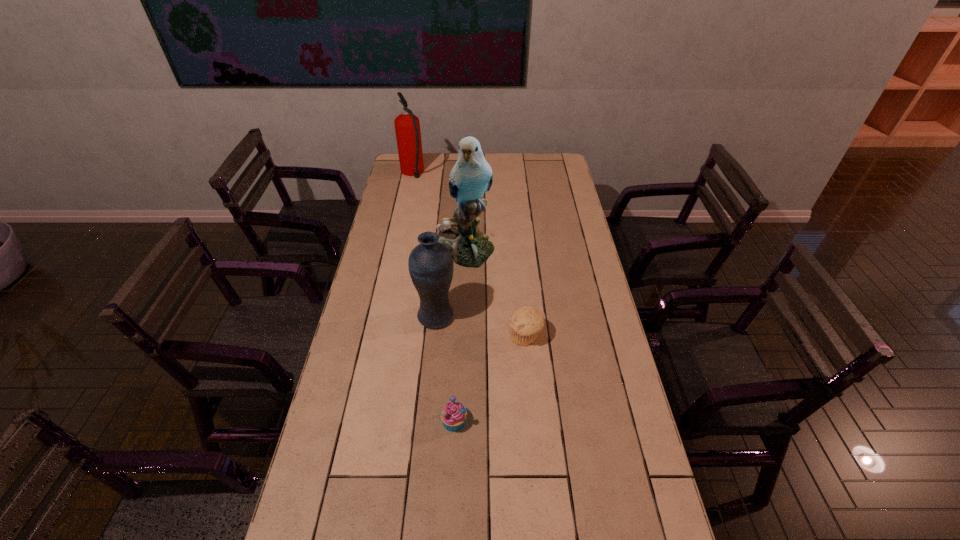
The width and height of the screenshot is (960, 540). Identify the location of vacant area situated 0.100m on the handle side of the fire extinguisher. (417, 153).

Where is `vacant area situated on the handle side of the fire extinguisher`? The height and width of the screenshot is (540, 960). vacant area situated on the handle side of the fire extinguisher is located at coordinates (417, 154).

The width and height of the screenshot is (960, 540). What are the coordinates of `free space located on the left of the vase` in the screenshot? It's located at (399, 316).

You are a GUI agent. You are given a task and a screenshot of the screen. Output one action in this format:
    pyautogui.click(x=<x>, y=<y>)
    Task: Click on the vacant space situated 0.240m on the left of the rightmost object
    
    Given the screenshot: What is the action you would take?
    pyautogui.click(x=438, y=336)

Identify the location of vacant space positioned 0.310m on the left of the left muffin. (333, 421).

In order to click on object that is at the far edge in this screenshot , I will do `click(407, 126)`.

At what (x,y) coordinates should I click in order to perform the action: click on object that is positioned at the left edge. Please return your answer as a coordinate pair (x, y). Looking at the image, I should click on (407, 126).

Identify the location of object positioned at the far left corner. Image resolution: width=960 pixels, height=540 pixels. (407, 126).

I want to click on vacant area at the far edge, so click(492, 157).

I want to click on free space at the left edge, so click(412, 187).